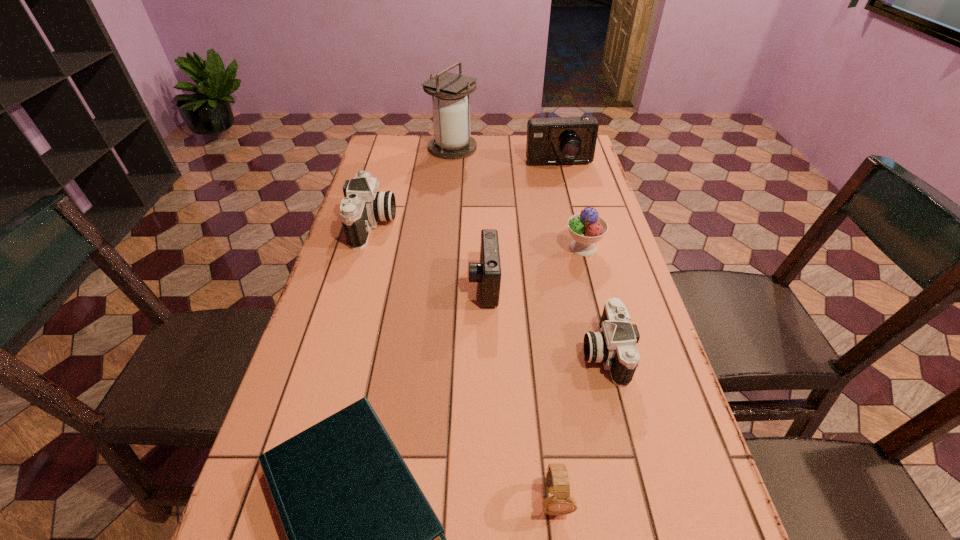
You are a GUI agent. You are given a task and a screenshot of the screen. Output one action in this format:
    pyautogui.click(x=<x>, y=<y>)
    Task: Click on the free space between the right blue camera and the nearer blue camera
    The width and height of the screenshot is (960, 540).
    Given the screenshot: What is the action you would take?
    pyautogui.click(x=521, y=224)

Locate an element on the screen. This screenshot has height=540, width=960. free space between the farther blue camera and the third camera from right to left is located at coordinates (521, 224).

This screenshot has height=540, width=960. What are the coordinates of `vacant area that lies between the seventh tallest object and the farther blue camera` in the screenshot? It's located at (557, 332).

This screenshot has width=960, height=540. I want to click on free area in between the watch and the icecream, so click(x=568, y=373).

At what (x,y) coordinates should I click in order to perform the action: click on empty space between the right black camera and the fifth object from left to right. Please return your answer as a coordinate pair (x, y). Looking at the image, I should click on (579, 426).

Where is `the third closest object relative to the tallest object`? The image size is (960, 540). the third closest object relative to the tallest object is located at coordinates (586, 228).

The height and width of the screenshot is (540, 960). In order to click on object that is the seventh closest to the icecream in this screenshot , I will do [558, 501].

Identify the location of the third closest camera to the left black camera. The height and width of the screenshot is (540, 960). (615, 345).

The height and width of the screenshot is (540, 960). I want to click on camera that is the fourth closest to the book, so click(566, 140).

Find the location of `free space that satisfies the following two spatial constraints: 1. on the back side of the icecream; 2. on the right side of the nearer black camera`. free space that satisfies the following two spatial constraints: 1. on the back side of the icecream; 2. on the right side of the nearer black camera is located at coordinates (579, 248).